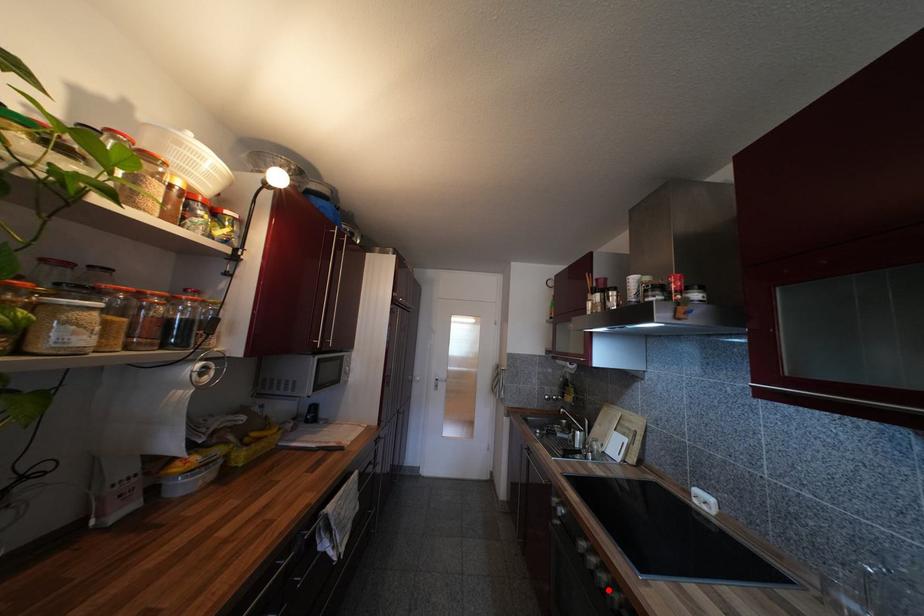
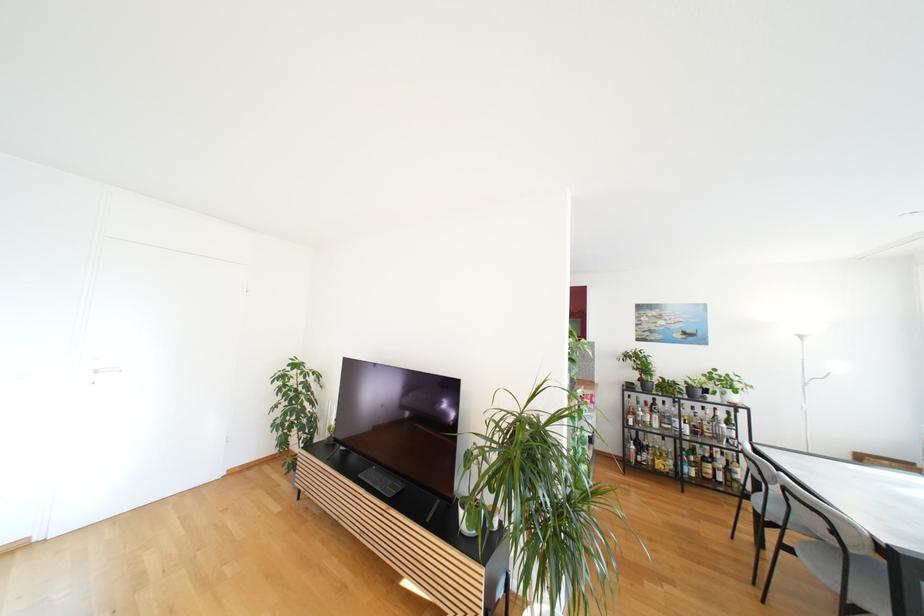
Question: I am providing you with two images of the same scene from different viewpoints. A red point is marked on the first image. Is the red point's position out of view in image 2?

Choices:
 (A) Yes
 (B) No

Answer: (A)